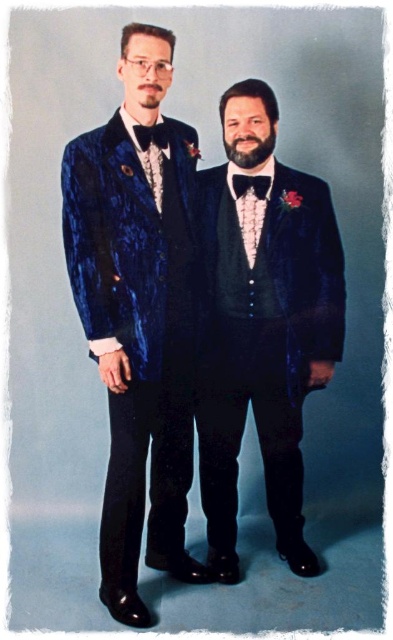
Question: Which object appears closest to the camera in this image?

Choices:
 (A) velvet blue tuxedo at center
 (B) black velvet bow tie at center
 (C) black satin bow tie at center
 (D) velvet blue tuxedo at left

Answer: (D)

Question: Can you confirm if velvet blue tuxedo at left is bigger than velvet blue tuxedo at center?

Choices:
 (A) yes
 (B) no

Answer: (A)

Question: Does velvet blue tuxedo at left appear over black satin bow tie at center?

Choices:
 (A) no
 (B) yes

Answer: (A)

Question: Which of these objects is positioned closest to the velvet blue tuxedo at left?

Choices:
 (A) velvet blue tuxedo at center
 (B) black velvet bow tie at center

Answer: (A)

Question: Estimate the real-world distances between objects in this image. Which object is farther from the black velvet bow tie at center?

Choices:
 (A) velvet blue tuxedo at center
 (B) black satin bow tie at center

Answer: (A)

Question: Can you confirm if black velvet bow tie at center is positioned above black satin bow tie at center?

Choices:
 (A) yes
 (B) no

Answer: (B)